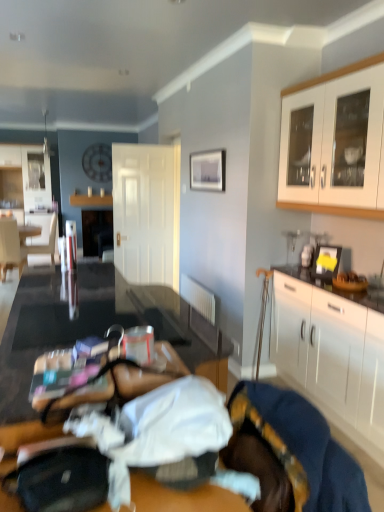
Question: Is white matte door at center in front of or behind wooden table at lower left in the image?

Choices:
 (A) behind
 (B) front

Answer: (A)

Question: Is white matte door at center bigger or smaller than wooden table at lower left?

Choices:
 (A) small
 (B) big

Answer: (B)

Question: Which object is positioned farthest from the matte silver picture frame at upper center?

Choices:
 (A) matte white chair at left
 (B) white fabric bed at lower center
 (C) wooden table at lower left
 (D) white glossy cabinet at upper right, acting as the second cabinetry starting from the bottom
 (E) white fabric armchair at left

Answer: (B)

Question: Which object is the closest to the white fabric bed at lower center?

Choices:
 (A) velvet blue blanket at lower right
 (B) wooden table at lower left
 (C) white fabric armchair at left
 (D) white matte door at center
 (E) white glossy cabinet at upper right, which ranks as the 1th cabinetry in top-to-bottom order

Answer: (A)